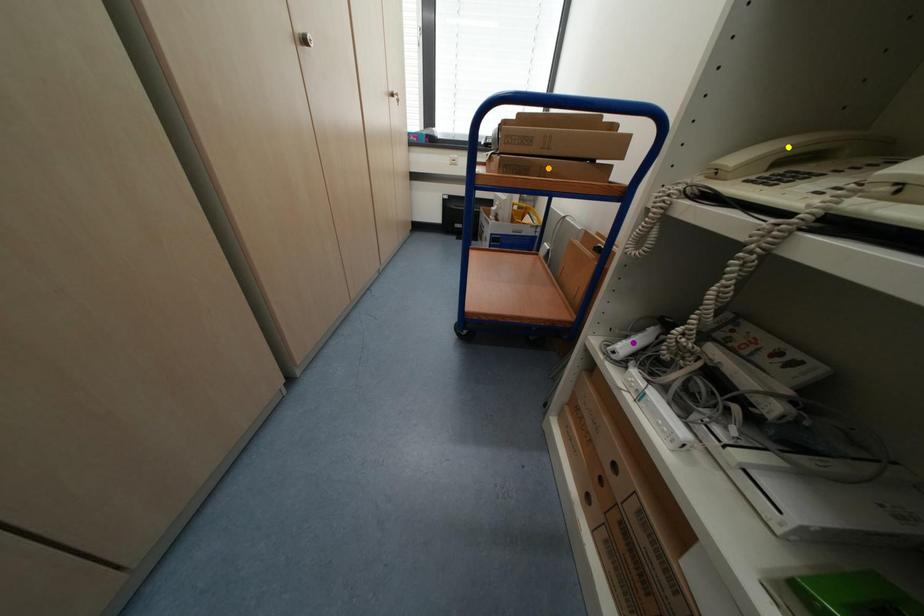
From the picture: Order these from nearest to farthest:
purple point
yellow point
orange point

yellow point → purple point → orange point